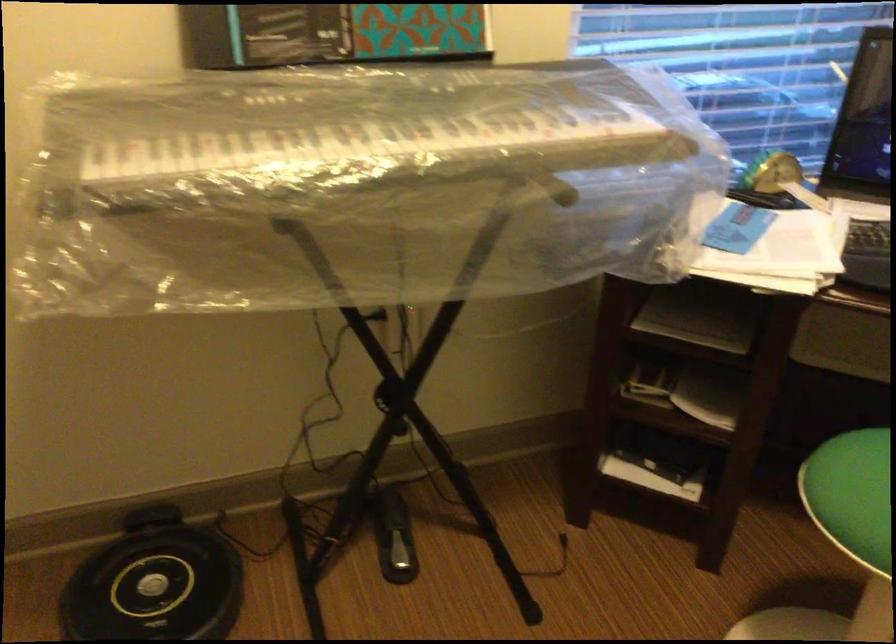
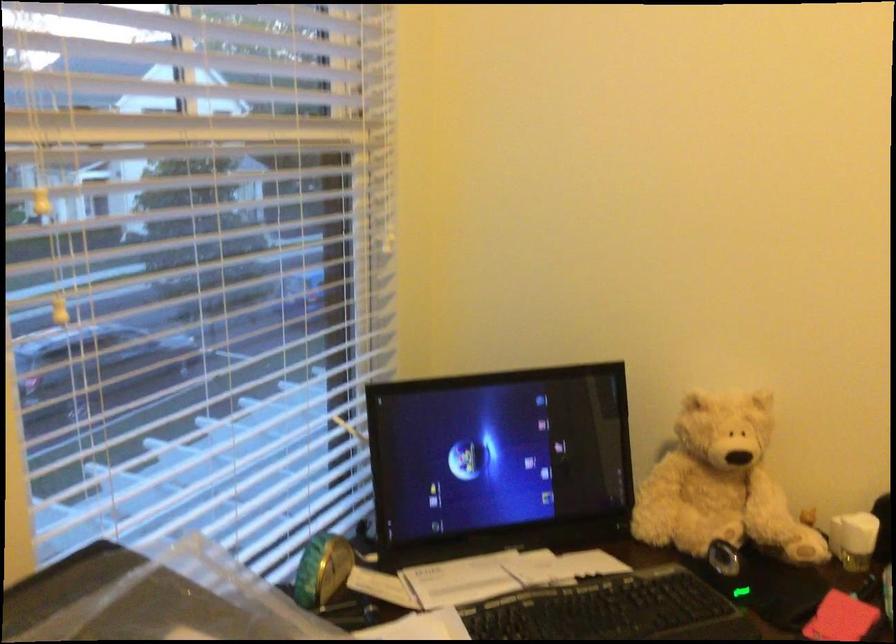
Question: The camera is either moving clockwise (left) or counter-clockwise (right) around the object. The first image is from the beginning of the video and the second image is from the end. Is the camera moving left or right when shooting the video?

Choices:
 (A) Left
 (B) Right

Answer: (A)